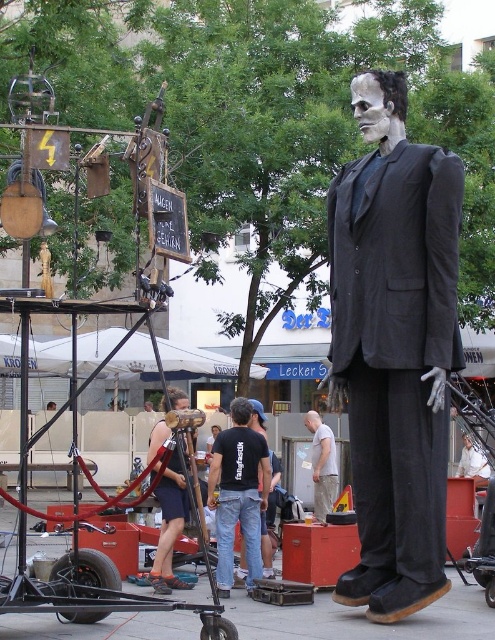
Does matte black suit at center appear on the right side of wooden microphone at center?

Indeed, matte black suit at center is positioned on the right side of wooden microphone at center.

This screenshot has height=640, width=495. What are the coordinates of `matte black suit at center` in the screenshot? It's located at (395, 348).

Is point (366, 115) closer to camera compared to point (180, 497)?

Yes, point (366, 115) is in front of point (180, 497).

You are a GUI agent. You are given a task and a screenshot of the screen. Output one action in this format:
    pyautogui.click(x=<x>, y=<y>)
    Task: Click on the matte black suit at center
    This screenshot has height=640, width=495.
    Given the screenshot: What is the action you would take?
    pyautogui.click(x=395, y=348)

This screenshot has width=495, height=640. I want to click on wooden microphone at center, so click(x=169, y=525).

Is wooden microphone at center above light gray cotton t-shirt at center?

No.

Does point (165, 497) come in front of point (324, 499)?

Yes, point (165, 497) is in front of point (324, 499).

Image resolution: width=495 pixels, height=640 pixels. I want to click on wooden microphone at center, so click(x=169, y=525).

Which is more to the right, black cotton t-shirt at center or light gray cotton t-shirt at center?

light gray cotton t-shirt at center is more to the right.

Does black cotton t-shirt at center appear over light gray cotton t-shirt at center?

Incorrect, black cotton t-shirt at center is not positioned above light gray cotton t-shirt at center.

Is point (216, 452) more distant than point (331, 497)?

No.

The height and width of the screenshot is (640, 495). What are the coordinates of `black cotton t-shirt at center` in the screenshot? It's located at (238, 492).